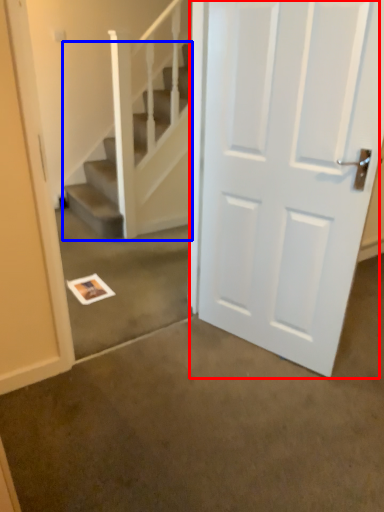
Question: Which point is closer to the camera, door (highlighted by a red box) or stairs (highlighted by a blue box)?

Choices:
 (A) door
 (B) stairs

Answer: (A)